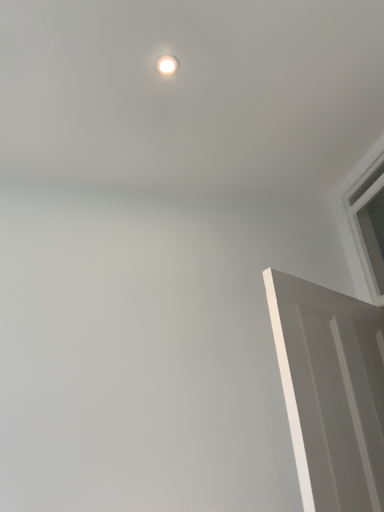
Question: From a real-world perspective, is white matte door at right positioned under white glossy light fixture at upper center based on gravity?

Choices:
 (A) yes
 (B) no

Answer: (A)

Question: Does white matte door at right appear on the right side of white glossy light fixture at upper center?

Choices:
 (A) no
 (B) yes

Answer: (B)

Question: Does white matte door at right have a lesser width compared to white glossy light fixture at upper center?

Choices:
 (A) no
 (B) yes

Answer: (A)

Question: Is white matte door at right further to camera compared to white glossy light fixture at upper center?

Choices:
 (A) yes
 (B) no

Answer: (B)

Question: Would you say white matte door at right is outside white glossy light fixture at upper center?

Choices:
 (A) yes
 (B) no

Answer: (A)

Question: Is white matte door at right placed right next to white glossy light fixture at upper center?

Choices:
 (A) yes
 (B) no

Answer: (B)

Question: Does white plastic window at upper right have a lesser width compared to white glossy light fixture at upper center?

Choices:
 (A) yes
 (B) no

Answer: (B)

Question: Can you confirm if white plastic window at upper right is taller than white glossy light fixture at upper center?

Choices:
 (A) yes
 (B) no

Answer: (A)

Question: Is white plastic window at upper right facing away from white glossy light fixture at upper center?

Choices:
 (A) no
 (B) yes

Answer: (A)

Question: Is white plastic window at upper right at the right side of white glossy light fixture at upper center?

Choices:
 (A) no
 (B) yes

Answer: (B)

Question: Could you tell me if white plastic window at upper right is turned towards white glossy light fixture at upper center?

Choices:
 (A) no
 (B) yes

Answer: (B)

Question: Is white plastic window at upper right smaller than white glossy light fixture at upper center?

Choices:
 (A) no
 (B) yes

Answer: (A)

Question: Would you say white glossy light fixture at upper center is outside white matte door at right?

Choices:
 (A) no
 (B) yes

Answer: (B)